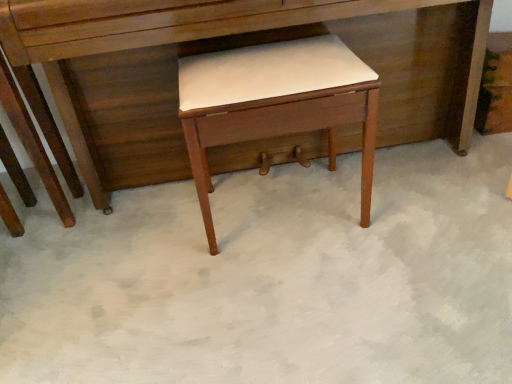
Locate an element on the screen. free point to the left of matte wood stool at center is located at coordinates (155, 237).